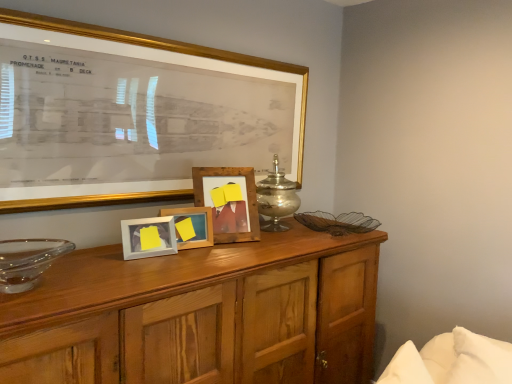
Image resolution: width=512 pixels, height=384 pixels. I want to click on vacant area that lies to the right of wooden photo frame at center, the 3th picture frame from the front, so [227, 243].